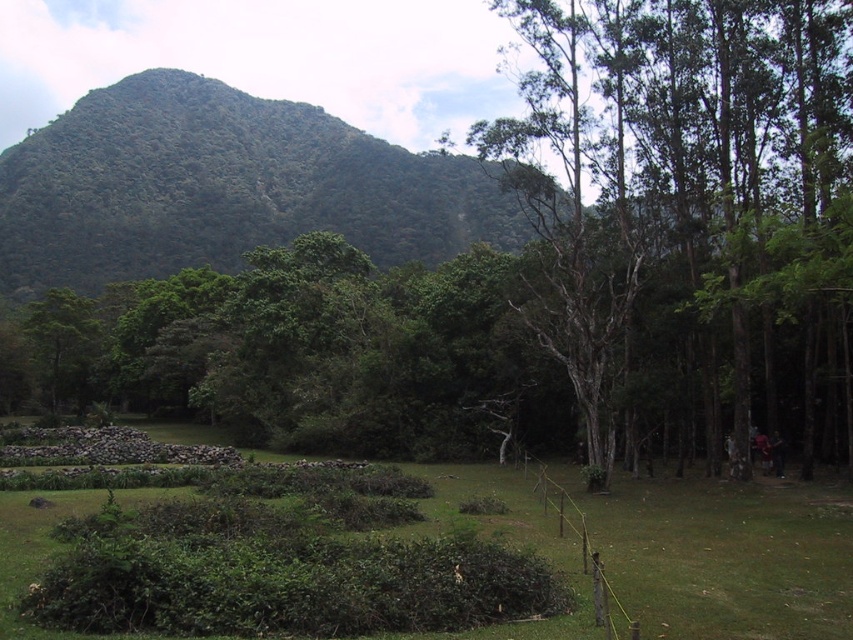
Is point (647, 204) less distant than point (198, 244)?

Yes, point (647, 204) is closer to viewer.

Identify the location of green leafy tree at right. Image resolution: width=853 pixels, height=640 pixels. click(x=686, y=193).

Who is lower down, green leafy hillside at upper left or green leafy hedge at center?

green leafy hedge at center is lower down.

Between green leafy hillside at upper left and green leafy hedge at center, which one appears on the right side from the viewer's perspective?

Positioned to the right is green leafy hedge at center.

Which is in front, point (171, 236) or point (492, 616)?

Point (492, 616) is more forward.

Where is `green leafy hillside at upper left`? The width and height of the screenshot is (853, 640). green leafy hillside at upper left is located at coordinates (224, 188).

Does green leafy tree at right appear on the right side of green leafy hedge at center?

Yes, green leafy tree at right is to the right of green leafy hedge at center.

The width and height of the screenshot is (853, 640). What do you see at coordinates (686, 193) in the screenshot? I see `green leafy tree at right` at bounding box center [686, 193].

Find the location of a particular element. This screenshot has width=853, height=640. green leafy tree at right is located at coordinates (686, 193).